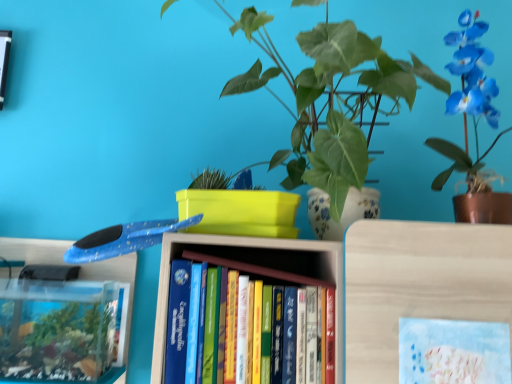
Question: Is hardcover books at center further to camera compared to blue glossy orchid at upper right, which is the first houseplant from right to left?

Choices:
 (A) yes
 (B) no

Answer: (B)

Question: Considering the relative sizes of hardcover books at center and blue glossy orchid at upper right, which is the first houseplant from right to left, in the image provided, is hardcover books at center shorter than blue glossy orchid at upper right, which is the first houseplant from right to left,?

Choices:
 (A) yes
 (B) no

Answer: (A)

Question: Does hardcover books at center have a greater width compared to blue glossy orchid at upper right, arranged as the second houseplant when viewed from the left?

Choices:
 (A) yes
 (B) no

Answer: (B)

Question: Considering the relative positions of hardcover books at center and blue glossy orchid at upper right, which is the first houseplant from right to left, in the image provided, is hardcover books at center to the right of blue glossy orchid at upper right, which is the first houseplant from right to left, from the viewer's perspective?

Choices:
 (A) no
 (B) yes

Answer: (A)

Question: From a real-world perspective, is hardcover books at center positioned under blue glossy orchid at upper right, arranged as the second houseplant when viewed from the left, based on gravity?

Choices:
 (A) yes
 (B) no

Answer: (A)

Question: Is hardcover books at center positioned far away from blue glossy orchid at upper right, arranged as the second houseplant when viewed from the left?

Choices:
 (A) no
 (B) yes

Answer: (A)

Question: Does green glossy leafy plant at center, marked as the 1th houseplant in a left-to-right arrangement, have a lesser width compared to blue glossy orchid at upper right, arranged as the second houseplant when viewed from the left?

Choices:
 (A) yes
 (B) no

Answer: (B)

Question: From the image's perspective, is green glossy leafy plant at center, marked as the 1th houseplant in a left-to-right arrangement, located beneath blue glossy orchid at upper right, arranged as the second houseplant when viewed from the left?

Choices:
 (A) yes
 (B) no

Answer: (B)

Question: Does green glossy leafy plant at center, marked as the 1th houseplant in a left-to-right arrangement, have a greater width compared to blue glossy orchid at upper right, arranged as the second houseplant when viewed from the left?

Choices:
 (A) no
 (B) yes

Answer: (B)

Question: From the image's perspective, is green glossy leafy plant at center, which is counted as the 2th houseplant, starting from the right, over blue glossy orchid at upper right, which is the first houseplant from right to left?

Choices:
 (A) yes
 (B) no

Answer: (A)

Question: Considering the relative positions of green glossy leafy plant at center, marked as the 1th houseplant in a left-to-right arrangement, and blue glossy orchid at upper right, which is the first houseplant from right to left, in the image provided, is green glossy leafy plant at center, marked as the 1th houseplant in a left-to-right arrangement, to the right of blue glossy orchid at upper right, which is the first houseplant from right to left, from the viewer's perspective?

Choices:
 (A) no
 (B) yes

Answer: (A)

Question: Are green glossy leafy plant at center, which is counted as the 2th houseplant, starting from the right, and blue glossy orchid at upper right, arranged as the second houseplant when viewed from the left, beside each other?

Choices:
 (A) yes
 (B) no

Answer: (B)

Question: Is green glossy leafy plant at center, which is counted as the 2th houseplant, starting from the right, positioned with its back to pastel blue paper at center?

Choices:
 (A) no
 (B) yes

Answer: (A)